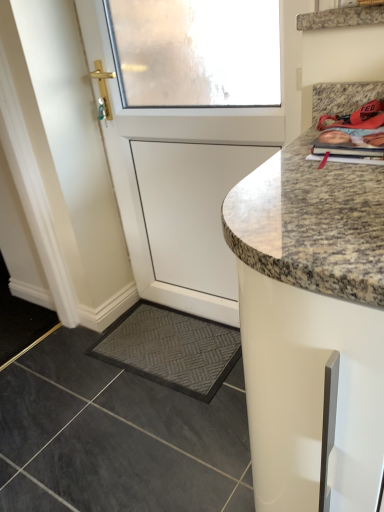
Question: From a real-world perspective, does dark gray textured mat at lower left sit lower than white matte door at upper left?

Choices:
 (A) yes
 (B) no

Answer: (A)

Question: Is dark gray textured mat at lower left positioned with its back to white matte door at upper left?

Choices:
 (A) yes
 (B) no

Answer: (B)

Question: Considering the relative sizes of dark gray textured mat at lower left and white matte door at upper left in the image provided, is dark gray textured mat at lower left taller than white matte door at upper left?

Choices:
 (A) yes
 (B) no

Answer: (B)

Question: From the image's perspective, is dark gray textured mat at lower left over white matte door at upper left?

Choices:
 (A) yes
 (B) no

Answer: (B)

Question: From a real-world perspective, is dark gray textured mat at lower left on white matte door at upper left?

Choices:
 (A) no
 (B) yes

Answer: (A)

Question: Is dark gray textured mat at lower left closer to the viewer compared to white matte door at upper left?

Choices:
 (A) no
 (B) yes

Answer: (A)

Question: Could matte orange magazine at upper right be considered to be inside white matte door at upper left?

Choices:
 (A) yes
 (B) no

Answer: (B)

Question: From the image's perspective, is white matte door at upper left under matte orange magazine at upper right?

Choices:
 (A) no
 (B) yes

Answer: (A)

Question: Is white matte door at upper left further to the viewer compared to matte orange magazine at upper right?

Choices:
 (A) no
 (B) yes

Answer: (B)

Question: Can you confirm if white matte door at upper left is shorter than matte orange magazine at upper right?

Choices:
 (A) yes
 (B) no

Answer: (B)

Question: Is white matte door at upper left thinner than matte orange magazine at upper right?

Choices:
 (A) yes
 (B) no

Answer: (A)

Question: Does white matte door at upper left have a larger size compared to matte orange magazine at upper right?

Choices:
 (A) no
 (B) yes

Answer: (B)

Question: From a real-world perspective, is granite at lower right on white matte door at upper left?

Choices:
 (A) yes
 (B) no

Answer: (B)